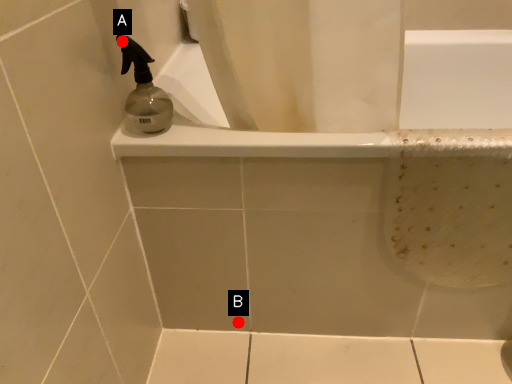
Question: Two points are circled on the image, labeled by A and B beside each circle. Which point is further to the camera?

Choices:
 (A) A is further
 (B) B is further

Answer: (B)